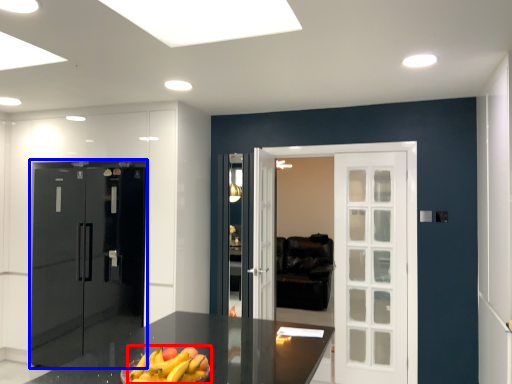
Question: Which point is closer to the camera, banana (highlighted by a red box) or door (highlighted by a blue box)?

Choices:
 (A) banana
 (B) door

Answer: (A)